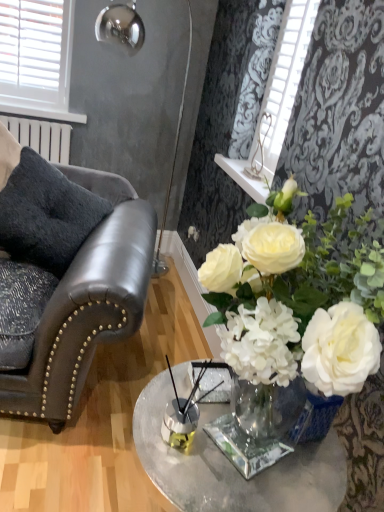
Question: Is dark gray plush pillow at left with black leather chair at left?

Choices:
 (A) no
 (B) yes

Answer: (A)

Question: From the image's perspective, would you say dark gray plush pillow at left is shown under black leather chair at left?

Choices:
 (A) no
 (B) yes

Answer: (A)

Question: Considering the relative sizes of dark gray plush pillow at left and black leather chair at left in the image provided, is dark gray plush pillow at left wider than black leather chair at left?

Choices:
 (A) no
 (B) yes

Answer: (A)

Question: From a real-world perspective, is dark gray plush pillow at left under black leather chair at left?

Choices:
 (A) yes
 (B) no

Answer: (B)

Question: Considering the relative positions of dark gray plush pillow at left and black leather chair at left in the image provided, is dark gray plush pillow at left to the left of black leather chair at left from the viewer's perspective?

Choices:
 (A) no
 (B) yes

Answer: (B)

Question: Is dark gray plush pillow at left taller or shorter than white plastic blinds at upper left?

Choices:
 (A) short
 (B) tall

Answer: (A)

Question: From the image's perspective, is dark gray plush pillow at left positioned above or below white plastic blinds at upper left?

Choices:
 (A) below
 (B) above

Answer: (A)

Question: From a real-world perspective, is dark gray plush pillow at left above or below white plastic blinds at upper left?

Choices:
 (A) above
 (B) below

Answer: (B)

Question: Looking at their shapes, would you say dark gray plush pillow at left is wider or thinner than white plastic blinds at upper left?

Choices:
 (A) wide
 (B) thin

Answer: (A)

Question: From the image's perspective, relative to black leather chair at left, is clear glass table at center above or below?

Choices:
 (A) below
 (B) above

Answer: (A)

Question: Is clear glass table at center wider or thinner than black leather chair at left?

Choices:
 (A) wide
 (B) thin

Answer: (B)

Question: In terms of height, does clear glass table at center look taller or shorter compared to black leather chair at left?

Choices:
 (A) short
 (B) tall

Answer: (A)

Question: Is clear glass table at center bigger or smaller than black leather chair at left?

Choices:
 (A) big
 (B) small

Answer: (B)

Question: Visually, is metallic silver lamp at upper left positioned to the left or to the right of clear glass table at center?

Choices:
 (A) right
 (B) left

Answer: (B)

Question: From a real-world perspective, is metallic silver lamp at upper left physically located above or below clear glass table at center?

Choices:
 (A) above
 (B) below

Answer: (A)